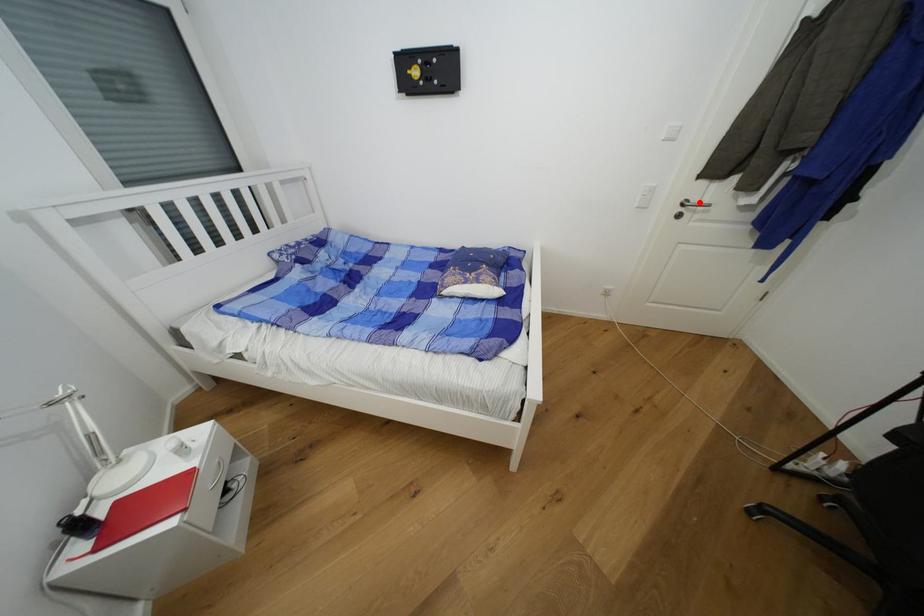
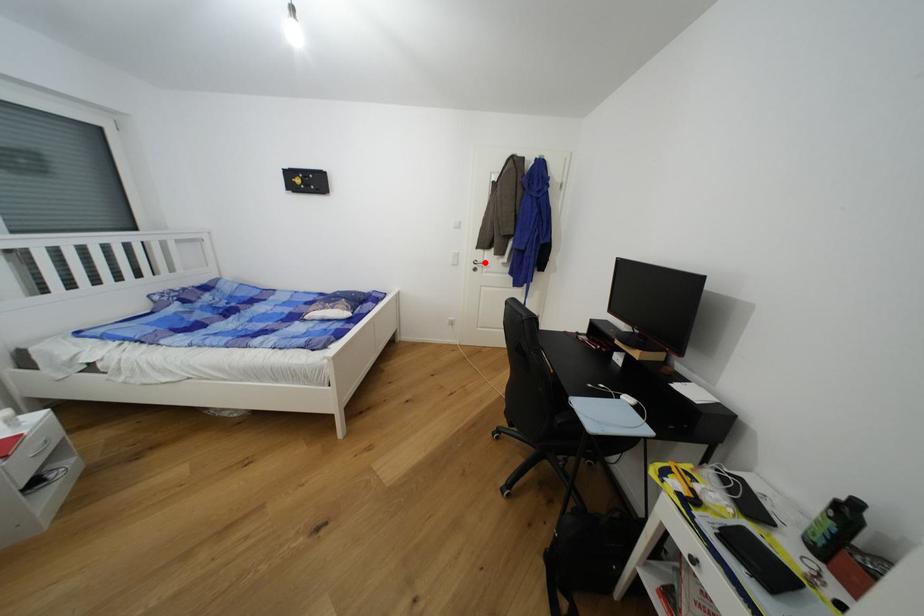
I am providing you with two images of the same scene from different viewpoints. A red point is marked on the first image and another point is marked on the second image. Does the point marked in image1 correspond to the same location as the one in image2?

Yes